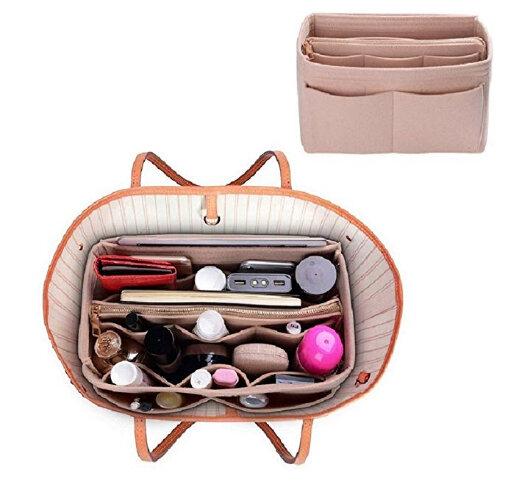
At what (x,y) coordinates should I click in order to perform the action: click on personal care products. Please return your answer as a coordinate pair (x, y). Looking at the image, I should click on point(225,374), point(202,377), point(126,374), point(206,324), point(324,352), point(168,398).